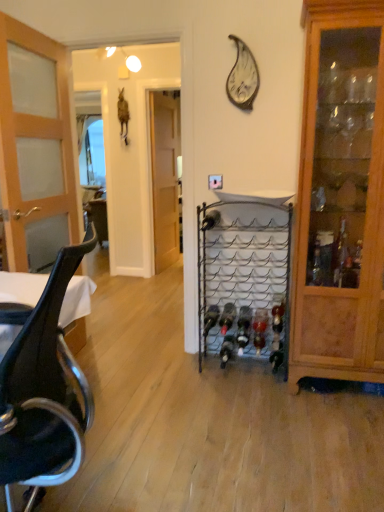
Question: From the image's perspective, is black leather chair at left positioned above or below translucent glass wine bottle at center, the 5th wine bottle positioned from the left?

Choices:
 (A) below
 (B) above

Answer: (A)

Question: Is black leather chair at left inside or outside of translucent glass wine bottle at center, which ranks as the 3th wine bottle in right-to-left order?

Choices:
 (A) inside
 (B) outside

Answer: (B)

Question: Estimate the real-world distances between objects in this image. Which object is farther from the black glass wine bottle at center, which appears as the 2th wine bottle when viewed from the left?

Choices:
 (A) wooden door at center, which ranks as the 1th door in back-to-front order
 (B) metallic silver wine bottle at center, placed as the fifth wine bottle when sorted from right to left
 (C) black glass wine bottle at center, which ranks as the 1th wine bottle in left-to-right order
 (D) metallic wire wine rack at center
 (E) translucent glass wine bottle at center, placed as the fourth wine bottle when sorted from right to left

Answer: (A)

Question: Which object is the closest to the translucent glass wine bottle at center, arranged as the second wine bottle when viewed from the right?

Choices:
 (A) translucent glass wine bottle at center, which ranks as the 3th wine bottle in right-to-left order
 (B) wooden door at center, which ranks as the 1th door in back-to-front order
 (C) translucent glass wine bottle at center, arranged as the first wine bottle when viewed from the right
 (D) metallic silver wine bottle at center, placed as the fifth wine bottle when sorted from right to left
 (E) translucent glass wine bottle at center, arranged as the fourth wine bottle when viewed from the left

Answer: (E)